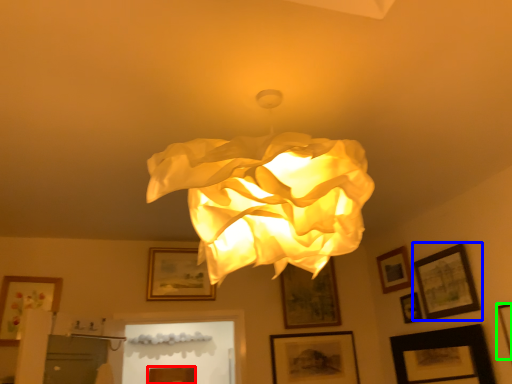
Question: Which object is positioned farthest from picture frame (highlighted by a red box)? Select from picture frame (highlighted by a blue box) and picture frame (highlighted by a green box).

Choices:
 (A) picture frame
 (B) picture frame

Answer: (B)